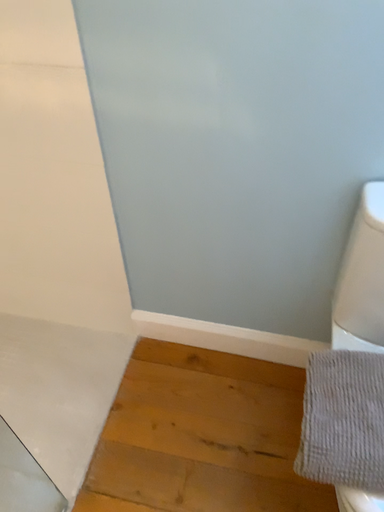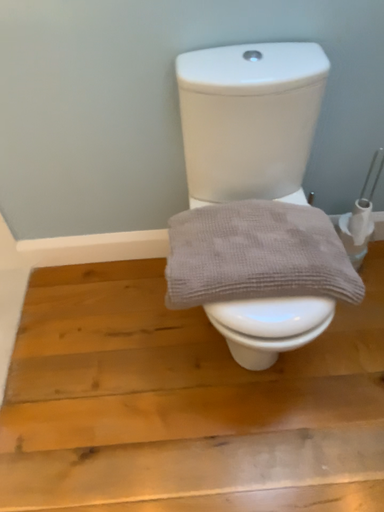
Question: Which way did the camera rotate in the video?

Choices:
 (A) rotated right
 (B) rotated left

Answer: (A)